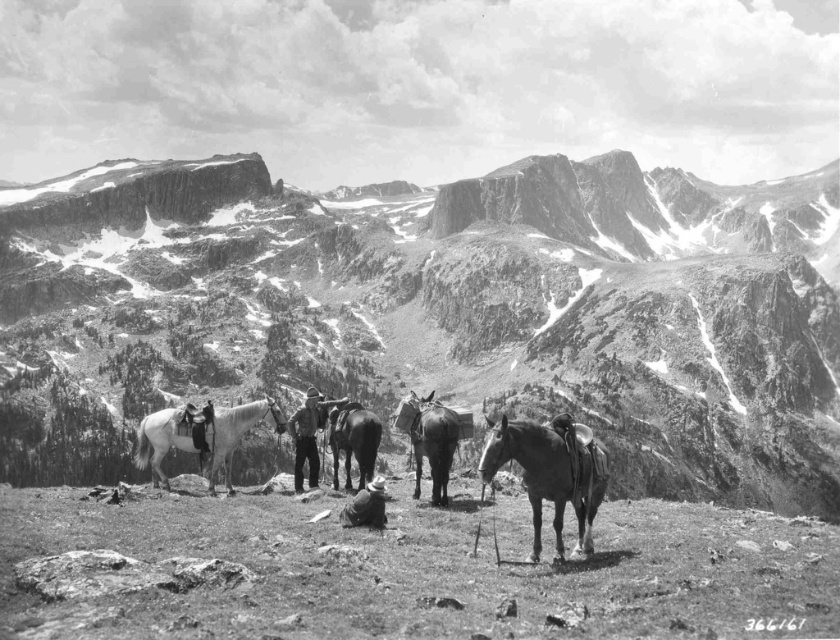
Question: Is rugged stone mountain range at center wider than white leather saddle at center?

Choices:
 (A) yes
 (B) no

Answer: (A)

Question: Among these objects, which one is farthest from the camera?

Choices:
 (A) shiny dark brown horse at center
 (B) shiny brown horse at center

Answer: (A)

Question: Which object appears closest to the camera in this image?

Choices:
 (A) shiny black donkey at center
 (B) shiny dark brown horse at center

Answer: (B)

Question: Among these points, which one is nearest to the camera?

Choices:
 (A) (219, 426)
 (B) (345, 401)
 (C) (538, 435)

Answer: (C)

Question: Can you confirm if shiny dark brown horse at center is bigger than shiny black donkey at center?

Choices:
 (A) no
 (B) yes

Answer: (B)

Question: Is shiny dark brown horse at center wider than shiny black donkey at center?

Choices:
 (A) yes
 (B) no

Answer: (A)